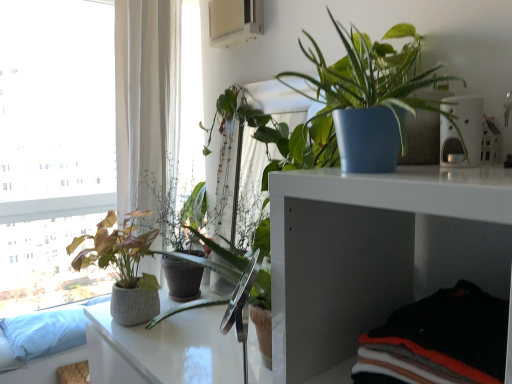
Question: In terms of width, does white glass window at left look wider or thinner when compared to textured gray pot at left, which is the first houseplant in bottom-to-top order?

Choices:
 (A) wide
 (B) thin

Answer: (B)

Question: From their relative heights in the image, would you say white glass window at left is taller or shorter than textured gray pot at left, positioned as the 1th houseplant in back-to-front order?

Choices:
 (A) tall
 (B) short

Answer: (A)

Question: Which object is the farthest from the blue matte pot at upper right, the 1th houseplant from the front?

Choices:
 (A) textured gray pot at left, placed as the 1th houseplant when sorted from left to right
 (B) white plastic pet feeder at upper right
 (C) white glossy table at center
 (D) white glass window at left
 (E) blue fabric couch at lower left

Answer: (D)

Question: Considering the real-world distances, which object is closest to the white plastic pet feeder at upper right?

Choices:
 (A) textured gray pot at left, the second houseplant when ordered from right to left
 (B) blue matte pot at upper right, the 1th houseplant from the front
 (C) white glass window at left
 (D) blue fabric couch at lower left
 (E) white glossy table at center

Answer: (B)